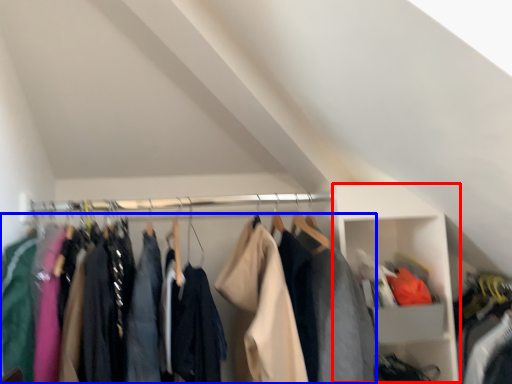
Question: Which of the following is the closest to the observer, cabinet (highlighted by a red box) or clothing (highlighted by a blue box)?

Choices:
 (A) cabinet
 (B) clothing

Answer: (B)